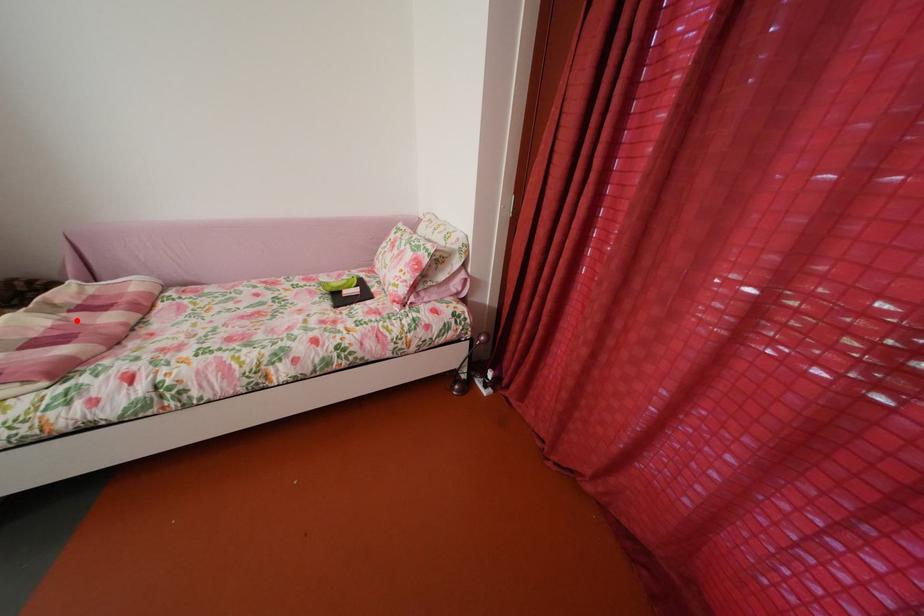
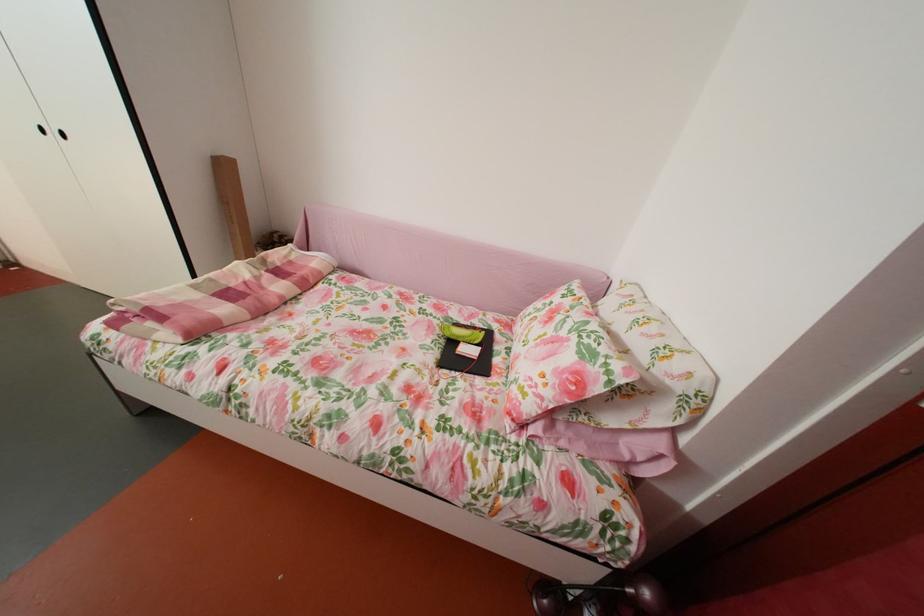
Question: I am providing you with two images of the same scene from different viewpoints. Given a red point in image1, look at the same physical point in image2. Is it:

Choices:
 (A) Closer to the viewpoint
 (B) Farther from the viewpoint

Answer: (B)